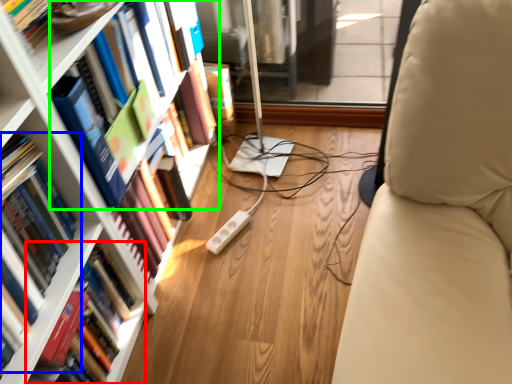
Question: Which is farther away from book (highlighted by a red box)? book (highlighted by a blue box) or book (highlighted by a green box)?

Choices:
 (A) book
 (B) book

Answer: (B)